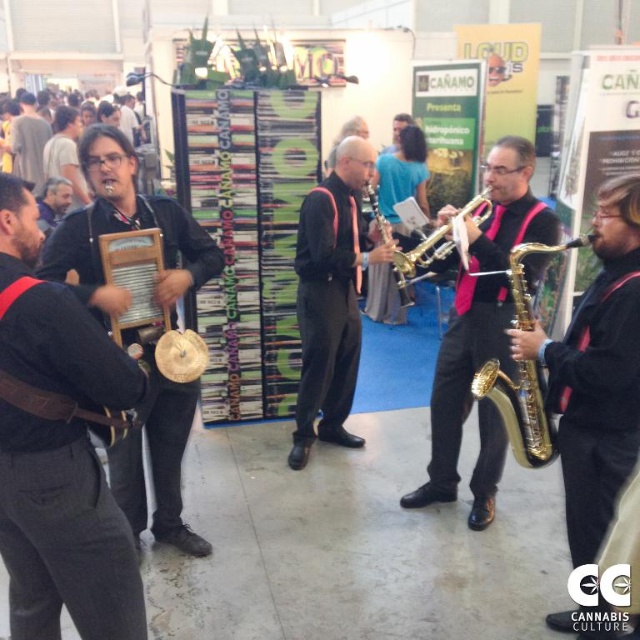
Question: Is black leather washboard at left above gold metallic saxophone at center?

Choices:
 (A) yes
 (B) no

Answer: (B)

Question: Can you confirm if gold shiny saxophone at center is thinner than gold shiny trumpet at center?

Choices:
 (A) yes
 (B) no

Answer: (B)

Question: Which of the following is the closest to the observer?

Choices:
 (A) (120, 212)
 (B) (380, 227)
 (C) (20, 157)

Answer: (A)

Question: Which point is closer to the camera taking this photo?

Choices:
 (A) (488, 352)
 (B) (17, 268)
 (C) (42, 170)

Answer: (B)

Question: Which of the following is the closest to the observer?

Choices:
 (A) gold shiny trumpet at center
 (B) black matte saxophone at center
 (C) gold shiny saxophone at right
 (D) gold brass trumpet at center

Answer: (C)

Question: Is gold shiny saxophone at center further to camera compared to gold metallic saxophone at center?

Choices:
 (A) yes
 (B) no

Answer: (B)